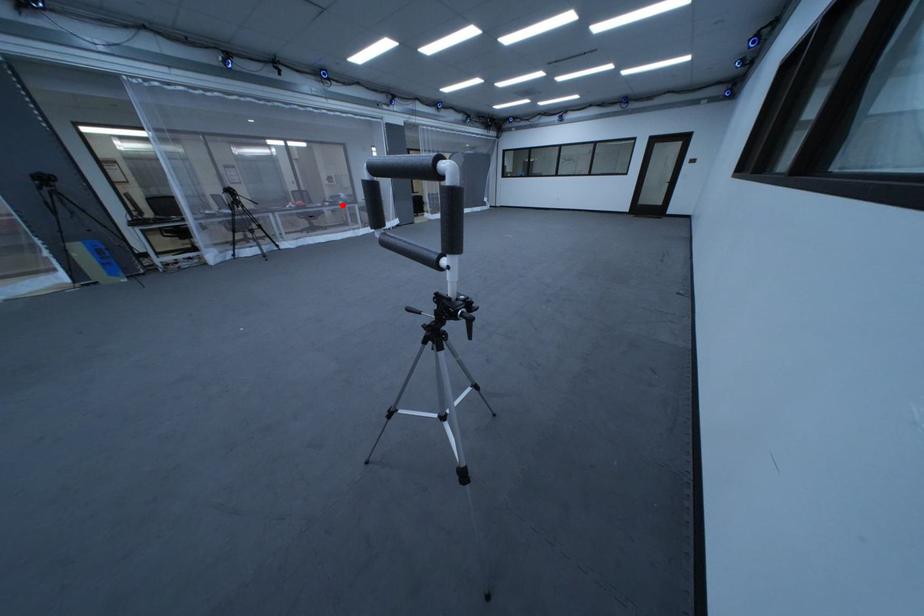
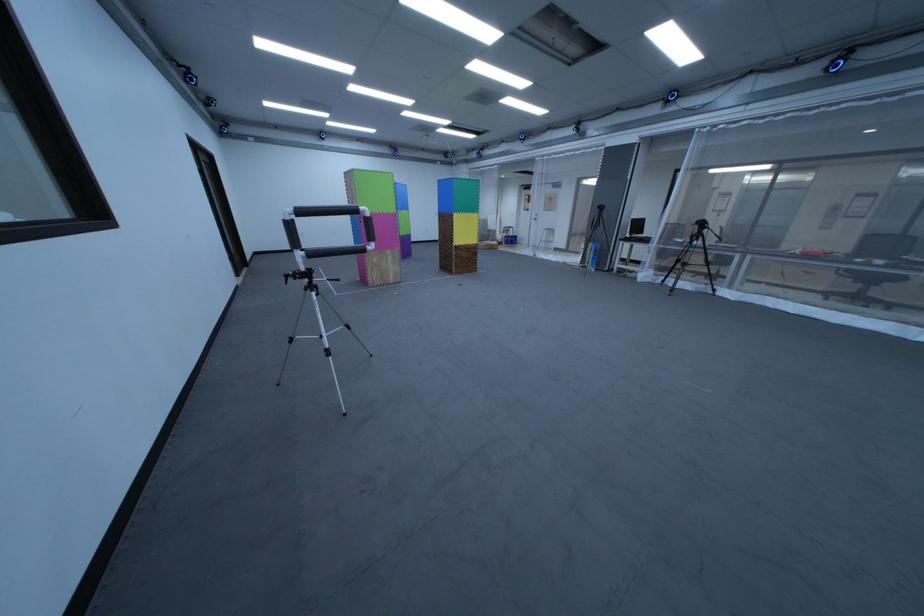
Question: I am providing you with two images of the same scene from different viewpoints. A red point is marked on the first image. Can you still see the location of the red point in image 2?

Choices:
 (A) Yes
 (B) No

Answer: (A)